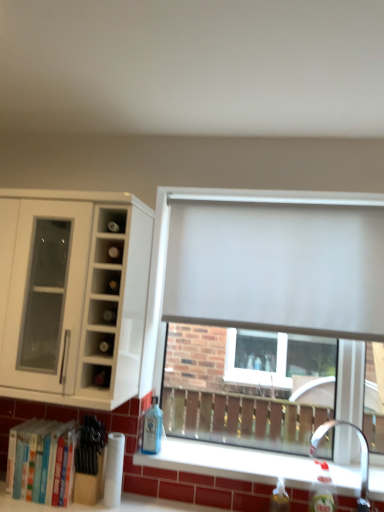
Where is `free spot to the right of blue glass bottle at lower center, the first bottle viewed from the back`? free spot to the right of blue glass bottle at lower center, the first bottle viewed from the back is located at coordinates (182, 459).